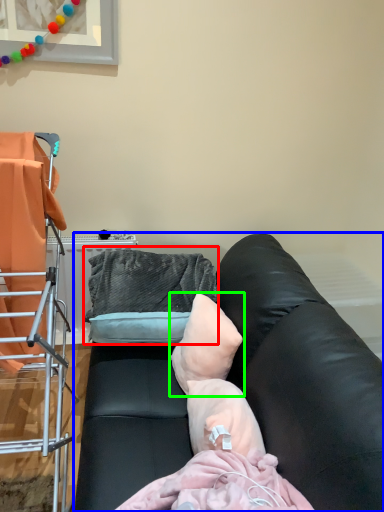
Question: Which object is positioned farthest from bean bag chair (highlighted by a red box)? Select from studio couch (highlighted by a blue box) and pillow (highlighted by a green box).

Choices:
 (A) studio couch
 (B) pillow

Answer: (A)